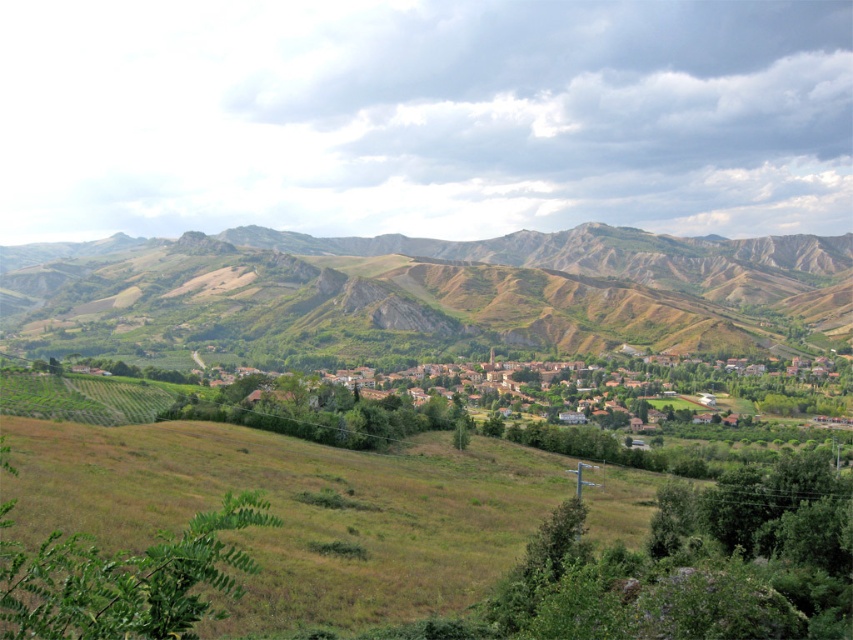
Question: Which point is farther from the camera taking this photo?

Choices:
 (A) pos(154,308)
 (B) pos(756,381)

Answer: (A)

Question: Can you confirm if green grassy hillside at center is thinner than brown tiled roofs at center?

Choices:
 (A) yes
 (B) no

Answer: (B)

Question: Among these objects, which one is farthest from the camera?

Choices:
 (A) brown tiled roofs at center
 (B) green grassy hillside at center

Answer: (B)

Question: Is green grassy hillside at center smaller than brown tiled roofs at center?

Choices:
 (A) yes
 (B) no

Answer: (B)

Question: Which object is closer to the camera taking this photo?

Choices:
 (A) green grassy hillside at center
 (B) brown tiled roofs at center

Answer: (B)

Question: From the image, what is the correct spatial relationship of green grassy hillside at center in relation to brown tiled roofs at center?

Choices:
 (A) left
 (B) right

Answer: (A)